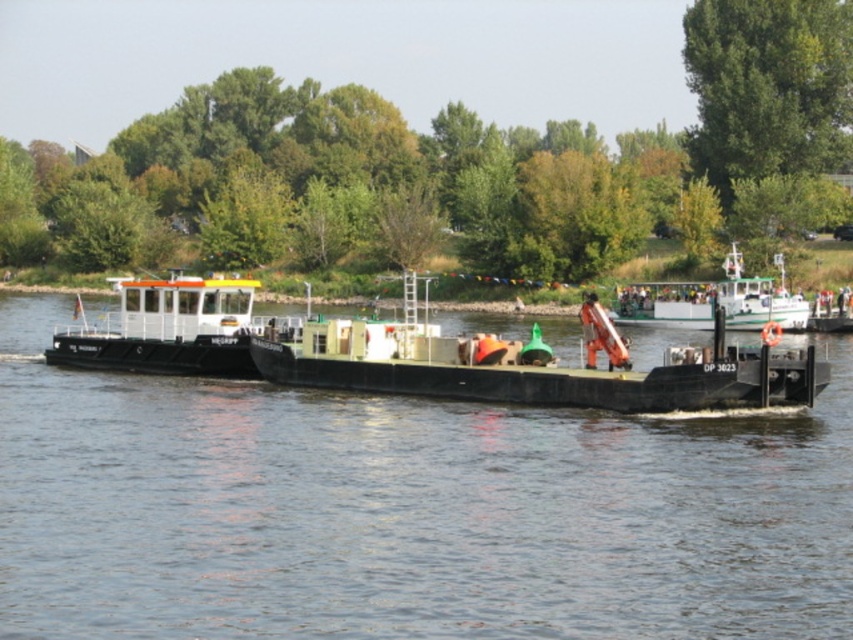
Question: Based on their relative distances, which object is farther from the white matte barge at left?

Choices:
 (A) black rubber boat at center
 (B) green matte barge at center

Answer: (A)

Question: From the image, what is the correct spatial relationship of green matte barge at center in relation to white matte barge at left?

Choices:
 (A) above
 (B) below

Answer: (B)

Question: Which object appears closest to the camera in this image?

Choices:
 (A) black rubber boat at center
 (B) green matte barge at center
 (C) white matte barge at left

Answer: (A)

Question: Which of these objects is positioned farthest from the green matte barge at center?

Choices:
 (A) black rubber boat at center
 (B) white matte barge at left

Answer: (B)

Question: Is black rubber boat at center further to camera compared to white matte barge at left?

Choices:
 (A) yes
 (B) no

Answer: (B)

Question: Can you confirm if black rubber boat at center is thinner than white matte barge at left?

Choices:
 (A) yes
 (B) no

Answer: (B)